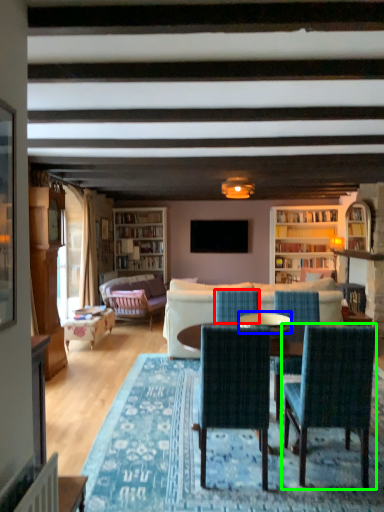
Question: Considering the real-world distances, which object is farthest from chair (highlighted by a red box)? glass table (highlighted by a blue box) or chair (highlighted by a green box)?

Choices:
 (A) glass table
 (B) chair

Answer: (B)